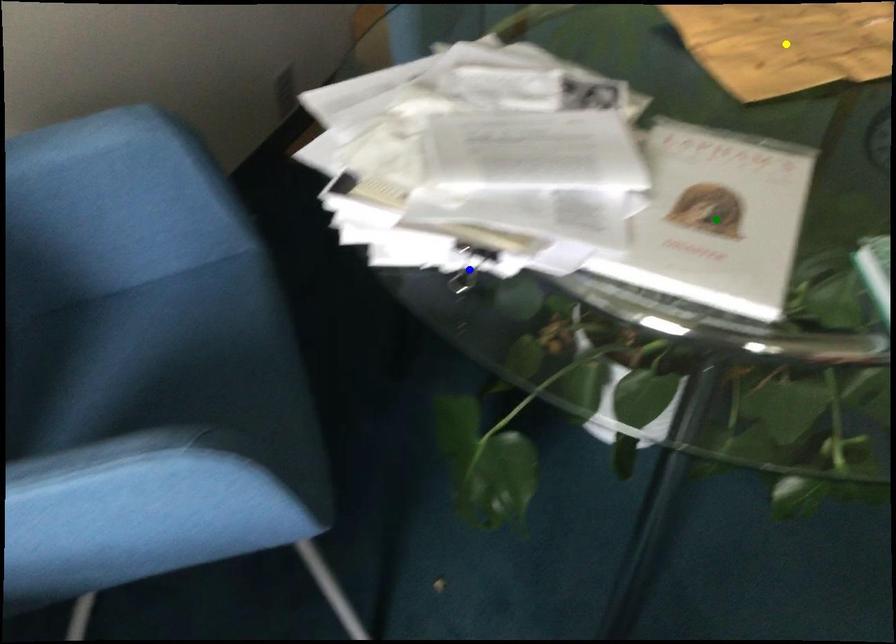
Based on the photo, order these from nearest to farthest:
A) yellow point
B) green point
C) blue point

green point → yellow point → blue point